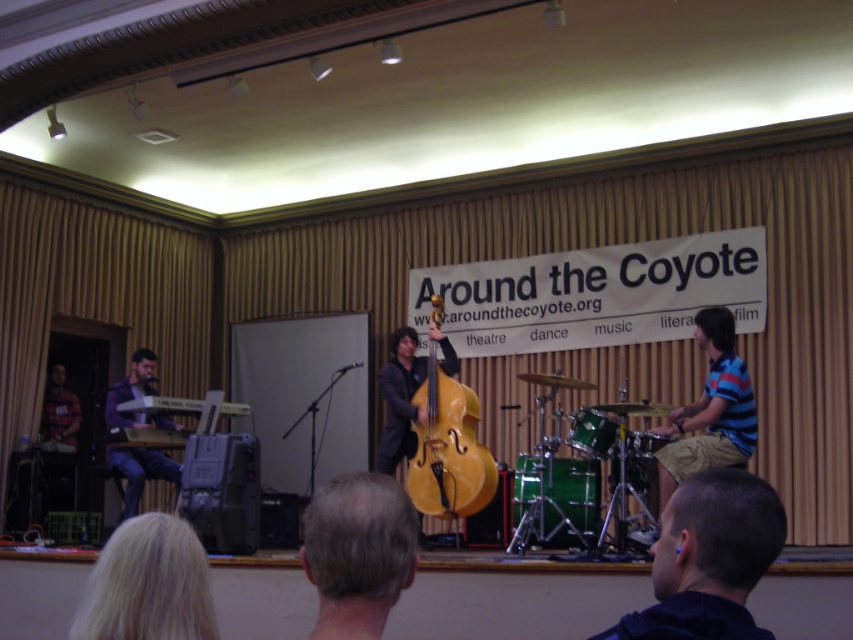
Can you confirm if dark blue hoodie at lower right is smaller than blue striped shirt at right?

Yes, dark blue hoodie at lower right is smaller than blue striped shirt at right.

Who is taller, dark blue hoodie at lower right or blue striped shirt at right?

blue striped shirt at right is taller.

In order to click on dark blue hoodie at lower right in this screenshot , I will do `click(708, 560)`.

Is dark blue hoodie at lower right to the right of golden polished wood cello at center from the viewer's perspective?

Yes, dark blue hoodie at lower right is to the right of golden polished wood cello at center.

Who is more forward, (764, 493) or (434, 408)?

Positioned in front is point (764, 493).

Locate an element on the screen. This screenshot has height=640, width=853. dark blue hoodie at lower right is located at coordinates (708, 560).

Which is below, dark blue hoodie at lower right or matte purple keyboard at left?

matte purple keyboard at left

Can you confirm if dark blue hoodie at lower right is positioned above matte purple keyboard at left?

Indeed, dark blue hoodie at lower right is positioned over matte purple keyboard at left.

Identify the location of dark blue hoodie at lower right. (708, 560).